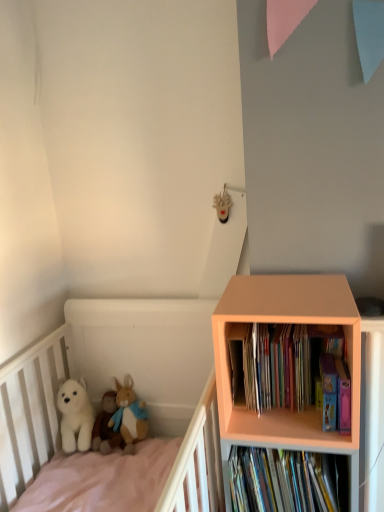
Question: Does white plush dog at lower left have a greater height compared to white plush at left?

Choices:
 (A) no
 (B) yes

Answer: (A)

Question: Is white plush dog at lower left outside of white plush at left?

Choices:
 (A) no
 (B) yes

Answer: (A)

Question: Considering the relative positions of white plush dog at lower left and white plush at left in the image provided, is white plush dog at lower left to the left of white plush at left from the viewer's perspective?

Choices:
 (A) no
 (B) yes

Answer: (B)

Question: Considering the relative positions of white plush dog at lower left and white plush at left in the image provided, is white plush dog at lower left behind white plush at left?

Choices:
 (A) yes
 (B) no

Answer: (A)

Question: Does white plush dog at lower left have a greater width compared to white plush at left?

Choices:
 (A) yes
 (B) no

Answer: (B)

Question: From a real-world perspective, is multicolored cardboard books at right, positioned as the first book in top-to-bottom order, above or below white plush bear at lower left, which is the 2th toy in right-to-left order?

Choices:
 (A) above
 (B) below

Answer: (A)

Question: Based on their sizes in the image, would you say multicolored cardboard books at right, positioned as the first book in top-to-bottom order, is bigger or smaller than white plush bear at lower left, which is the 2th toy in right-to-left order?

Choices:
 (A) big
 (B) small

Answer: (A)

Question: Considering the positions of multicolored cardboard books at right, positioned as the first book in top-to-bottom order, and white plush bear at lower left, which is the first toy from left to right, in the image, is multicolored cardboard books at right, positioned as the first book in top-to-bottom order, taller or shorter than white plush bear at lower left, which is the first toy from left to right,?

Choices:
 (A) short
 (B) tall

Answer: (B)

Question: From the image's perspective, is multicolored cardboard books at right, positioned as the first book in top-to-bottom order, above or below white plush bear at lower left, which is the first toy from left to right?

Choices:
 (A) above
 (B) below

Answer: (A)

Question: Looking at the image, does hardcover books at lower right, which is the 1th book in bottom-to-top order, seem bigger or smaller compared to white plush at left?

Choices:
 (A) small
 (B) big

Answer: (A)

Question: Considering the positions of point (284, 461) and point (157, 309), is point (284, 461) closer or farther from the camera than point (157, 309)?

Choices:
 (A) closer
 (B) farther

Answer: (A)

Question: From the image's perspective, relative to white plush at left, is hardcover books at lower right, marked as the 2th book in a top-to-bottom arrangement, above or below?

Choices:
 (A) below
 (B) above

Answer: (B)

Question: Relative to white plush at left, is hardcover books at lower right, which is the 1th book in bottom-to-top order, in front or behind?

Choices:
 (A) front
 (B) behind

Answer: (B)

Question: From a real-world perspective, is multicolored cardboard books at right, positioned as the first book in top-to-bottom order, positioned above or below white plush at left?

Choices:
 (A) below
 (B) above

Answer: (B)

Question: Is multicolored cardboard books at right, the second book positioned from the bottom, situated inside white plush at left or outside?

Choices:
 (A) inside
 (B) outside

Answer: (B)